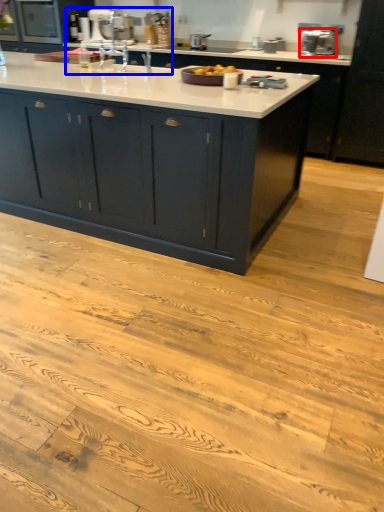
Question: Which point is further to the camera, appliance (highlighted by a red box) or sink (highlighted by a blue box)?

Choices:
 (A) appliance
 (B) sink

Answer: (A)